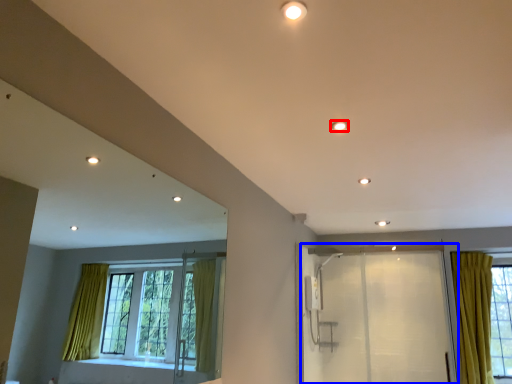
Question: Which object is further to the camera taking this photo, lighting (highlighted by a red box) or screen door (highlighted by a blue box)?

Choices:
 (A) lighting
 (B) screen door

Answer: (B)